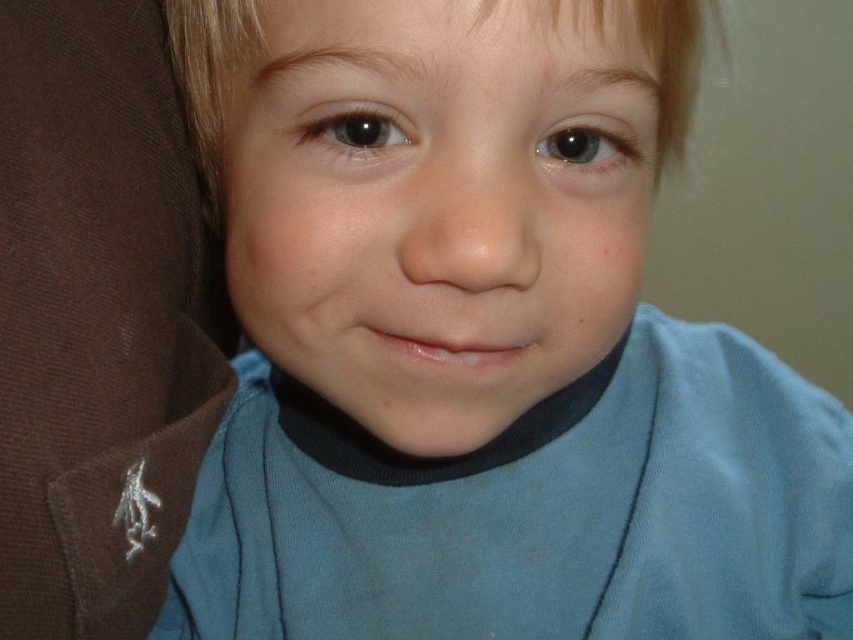
Question: Can you confirm if matte brown fabric at left is thinner than blonde smooth hair at center?

Choices:
 (A) no
 (B) yes

Answer: (B)

Question: Is matte brown fabric at left behind blonde smooth hair at center?

Choices:
 (A) no
 (B) yes

Answer: (B)

Question: Where is matte brown fabric at left located in relation to blonde smooth hair at center in the image?

Choices:
 (A) below
 (B) above

Answer: (A)

Question: Which point appears closest to the camera in this image?

Choices:
 (A) (131, 609)
 (B) (653, 54)

Answer: (B)